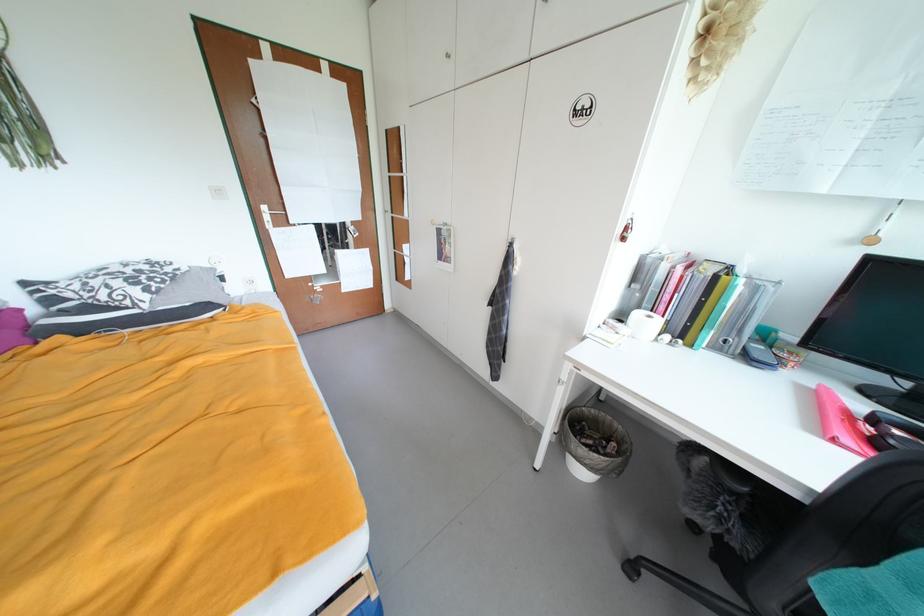
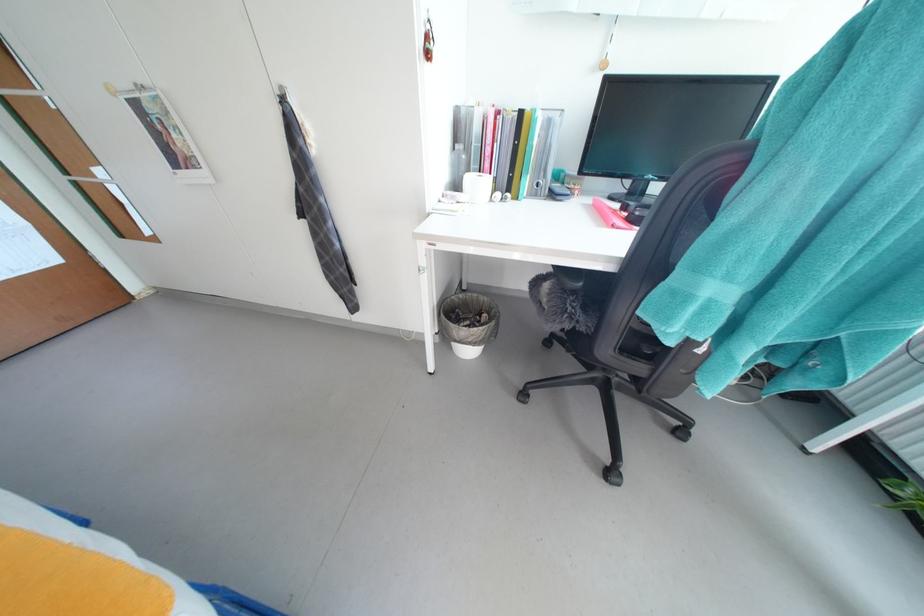
Locate, in the second image, the point that corresponds to the point at 593,464 in the first image.

(478, 342)